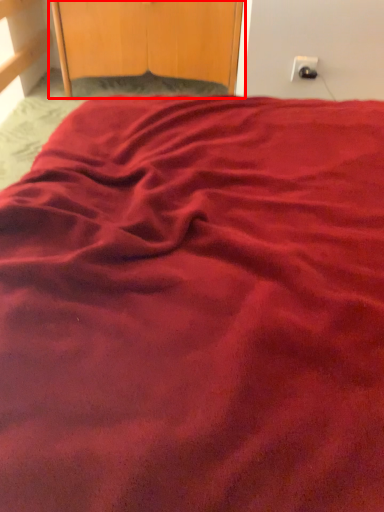
Question: Where is dresser (annotated by the red box) located in relation to electric outlet in the image?

Choices:
 (A) left
 (B) right

Answer: (A)